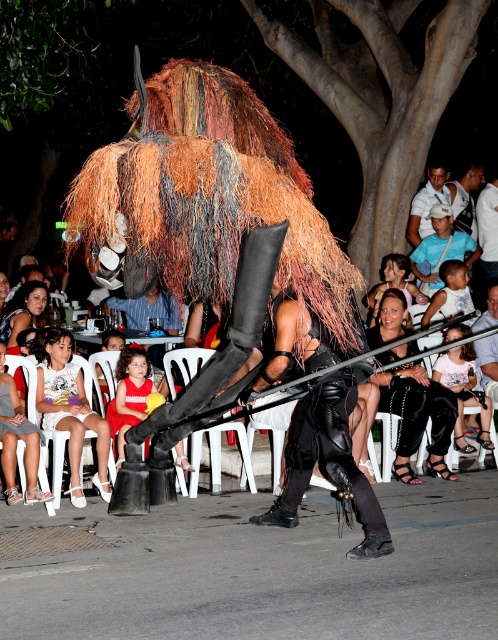
In the scene shown: You are a photographer at the event and need to capture both the red satin dress at center and the smooth black dress at center in a single frame. Which dress should you focus on first to ensure they both fit in the photo?

The red satin dress at center is smaller than the smooth black dress at center, so you should focus on the smooth black dress at center first to ensure both dresses fit in the photo.

You are a photographer trying to capture the performer in the center. You notice the light blue cotton shirt at upper right and the shiny gold armor at center. Which object is closer to your camera lens?

The light blue cotton shirt at upper right is closer to the camera lens because it is further to the viewer than the shiny gold armor at center.

You are a photographer at the event and need to capture the performer in their matte black dress at lower center. Where should you position your camera to ensure the dress is clearly visible?

To capture the matte black dress at lower center, position the camera at point (464, 392) where the dress is located.